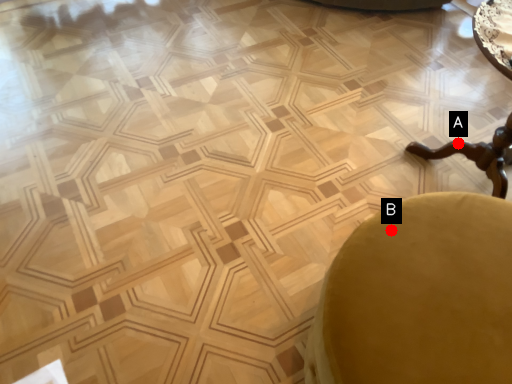
Question: Two points are circled on the image, labeled by A and B beside each circle. Which of the following is the farthest from the observer?

Choices:
 (A) A is further
 (B) B is further

Answer: (A)